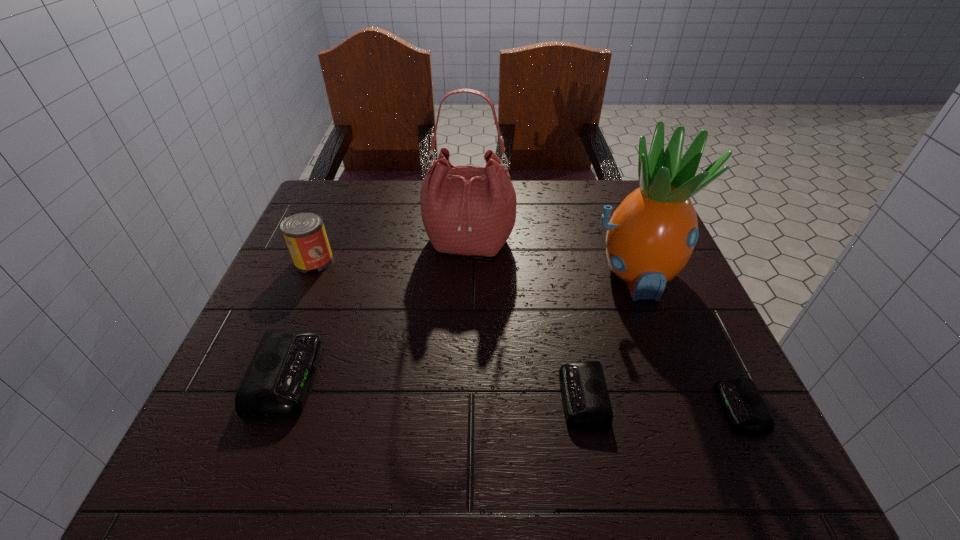
Find the location of `location for an additional alarm_clock to make spacing equal`. location for an additional alarm_clock to make spacing equal is located at coordinates (432, 387).